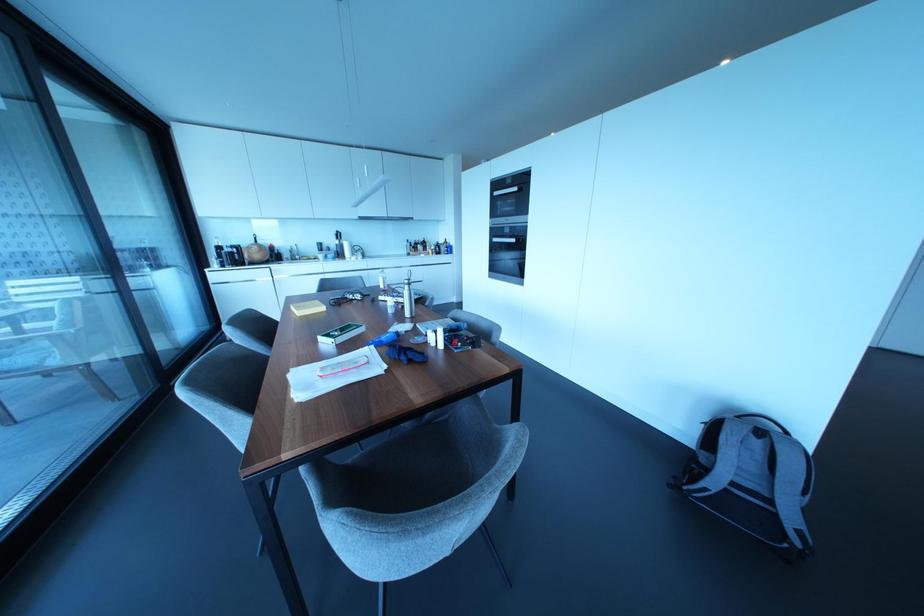
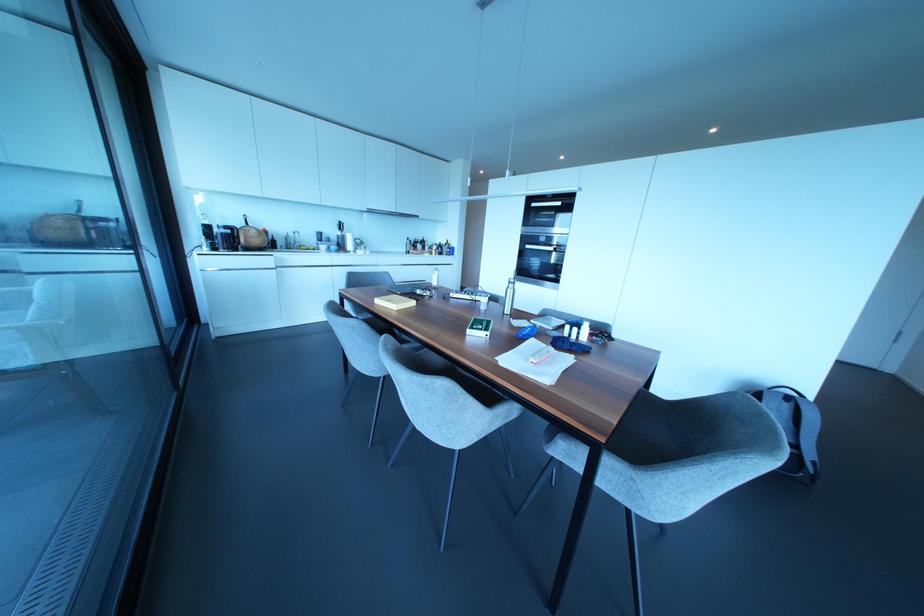
The point at (320, 338) is marked in the first image. Where is the corresponding point in the second image?

(468, 331)